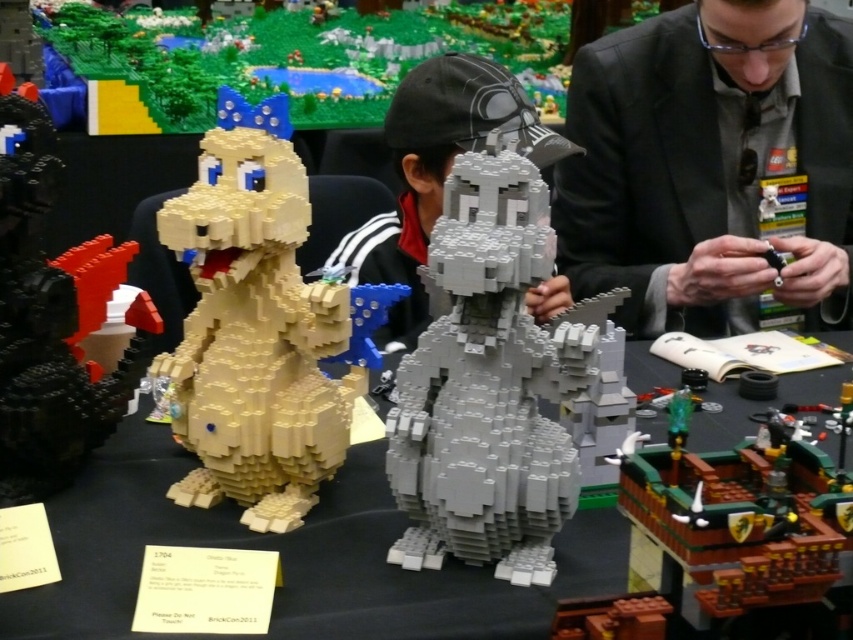
Describe the element at coordinates (51, 316) in the screenshot. The width and height of the screenshot is (853, 640). I see `brick red dragon at left` at that location.

Is point (28, 330) positioned in front of point (477, 141)?

Yes, point (28, 330) is in front of point (477, 141).

Locate an element on the screen. The height and width of the screenshot is (640, 853). brick red dragon at left is located at coordinates (51, 316).

Does dark gray suit at center appear on the left side of matte plastic table at center?

In fact, dark gray suit at center is to the right of matte plastic table at center.

What are the coordinates of `dark gray suit at center` in the screenshot? It's located at (708, 163).

The height and width of the screenshot is (640, 853). Find the location of `dark gray suit at center`. dark gray suit at center is located at coordinates (x=708, y=163).

Who is positioned more to the right, gray matte lego dragon at center or matte yellow lego dinosaur at left?

Positioned to the right is gray matte lego dragon at center.

Can you confirm if gray matte lego dragon at center is taller than matte yellow lego dinosaur at left?

No.

Image resolution: width=853 pixels, height=640 pixels. Identify the location of gray matte lego dragon at center. [490, 381].